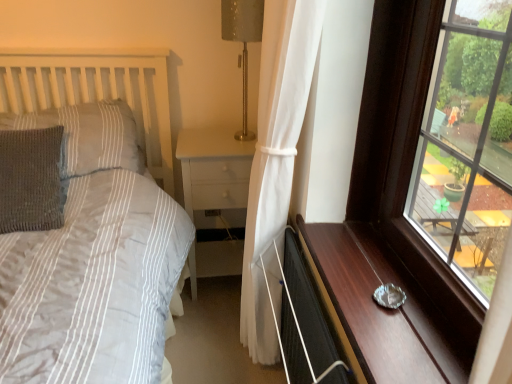
Question: Would you say metallic gray table lamp at upper center contains metallic silver ashtray at right?

Choices:
 (A) no
 (B) yes

Answer: (A)

Question: Can you confirm if metallic gray table lamp at upper center is positioned to the left of metallic silver ashtray at right?

Choices:
 (A) no
 (B) yes

Answer: (B)

Question: Is metallic gray table lamp at upper center smaller than metallic silver ashtray at right?

Choices:
 (A) no
 (B) yes

Answer: (A)

Question: Is metallic gray table lamp at upper center shorter than metallic silver ashtray at right?

Choices:
 (A) yes
 (B) no

Answer: (B)

Question: Considering the relative sizes of metallic gray table lamp at upper center and metallic silver ashtray at right in the image provided, is metallic gray table lamp at upper center wider than metallic silver ashtray at right?

Choices:
 (A) yes
 (B) no

Answer: (B)

Question: Considering the relative positions of metallic gray table lamp at upper center and metallic silver ashtray at right in the image provided, is metallic gray table lamp at upper center in front of metallic silver ashtray at right?

Choices:
 (A) no
 (B) yes

Answer: (A)

Question: Is gray knitted pillow at left, the 2th pillow from the top, placed right next to transparent glass window at right?

Choices:
 (A) yes
 (B) no

Answer: (B)

Question: Can you confirm if gray knitted pillow at left, which is counted as the 1th pillow, starting from the bottom, is wider than transparent glass window at right?

Choices:
 (A) yes
 (B) no

Answer: (A)

Question: Can you confirm if gray knitted pillow at left, which is counted as the 1th pillow, starting from the bottom, is shorter than transparent glass window at right?

Choices:
 (A) yes
 (B) no

Answer: (A)

Question: From a real-world perspective, is gray knitted pillow at left, which is counted as the 1th pillow, starting from the bottom, on top of transparent glass window at right?

Choices:
 (A) yes
 (B) no

Answer: (B)

Question: From a real-world perspective, is gray knitted pillow at left, the 2th pillow from the top, located beneath transparent glass window at right?

Choices:
 (A) yes
 (B) no

Answer: (A)

Question: From the image's perspective, is gray knitted pillow at left, which is counted as the 1th pillow, starting from the bottom, below transparent glass window at right?

Choices:
 (A) no
 (B) yes

Answer: (A)

Question: Is knitted gray pillow at left, which is the second pillow from bottom to top, wider than metallic silver ashtray at right?

Choices:
 (A) yes
 (B) no

Answer: (A)